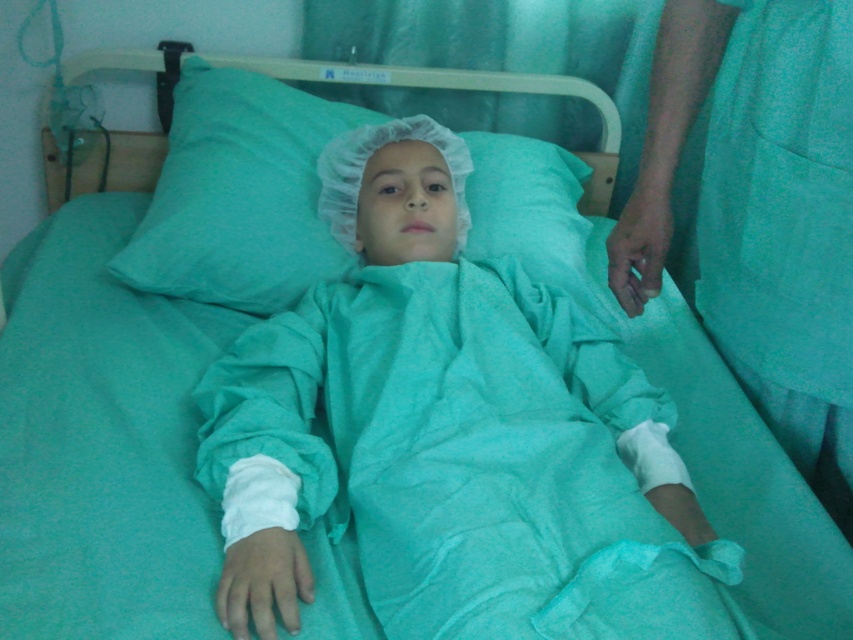
Where is `green fabric at right`? This screenshot has width=853, height=640. green fabric at right is located at coordinates (761, 214).

Is green fabric at right positioned in front of teal fabric pillow at center?

That is True.

Which is in front, point (755, 376) or point (579, 177)?

Point (755, 376) is in front.

Where is `green fabric at right`? The image size is (853, 640). green fabric at right is located at coordinates (761, 214).

Between teal fabric gown at center and green fabric at right, which one is positioned higher?

green fabric at right

Is teal fabric gown at center smaller than green fabric at right?

No, teal fabric gown at center is not smaller than green fabric at right.

Locate an element on the screen. teal fabric gown at center is located at coordinates (451, 435).

Who is positioned more to the left, teal fabric gown at center or teal fabric pillow at center?

From the viewer's perspective, teal fabric pillow at center appears more on the left side.

Is point (300, 563) more distant than point (589, 304)?

That is False.

Locate an element on the screen. The image size is (853, 640). teal fabric gown at center is located at coordinates (451, 435).